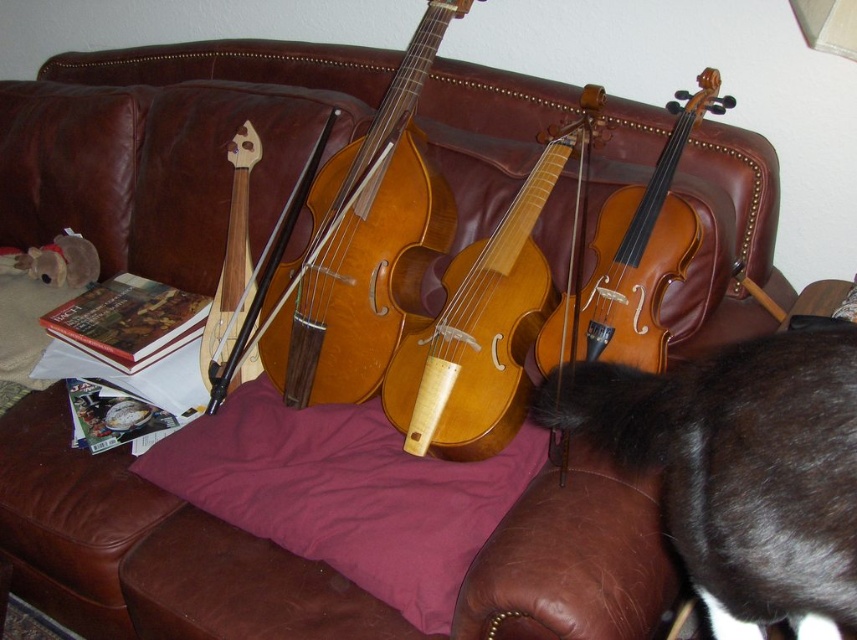
Is the position of light brown wood cello at center more distant than that of light brown wood violin at center?

Yes.

How far apart are light brown wood cello at center and light brown wood violin at center?

light brown wood cello at center is 6.60 inches away from light brown wood violin at center.

Is point (283, 364) closer to viewer compared to point (561, 140)?

No, (283, 364) is further to viewer.

Find the location of `light brown wood cello at center`. light brown wood cello at center is located at coordinates (364, 248).

Which of these two, purple cotton pillow at center or wooden violin at center, stands taller?

wooden violin at center is taller.

Measure the distance from purple cotton pillow at center to wooden violin at center.

A distance of 10.30 inches exists between purple cotton pillow at center and wooden violin at center.

The image size is (857, 640). Describe the element at coordinates (346, 492) in the screenshot. I see `purple cotton pillow at center` at that location.

At what (x,y) coordinates should I click in order to perform the action: click on purple cotton pillow at center. Please return your answer as a coordinate pair (x, y). Looking at the image, I should click on (346, 492).

Is purple cotton pillow at center wider than shiny brown violin at center?

Correct, the width of purple cotton pillow at center exceeds that of shiny brown violin at center.

Can you confirm if purple cotton pillow at center is taller than shiny brown violin at center?

In fact, purple cotton pillow at center may be shorter than shiny brown violin at center.

Is point (493, 516) positioned after point (559, 312)?

No, it is in front of (559, 312).

Find the location of a particular element. The image size is (857, 640). purple cotton pillow at center is located at coordinates (346, 492).